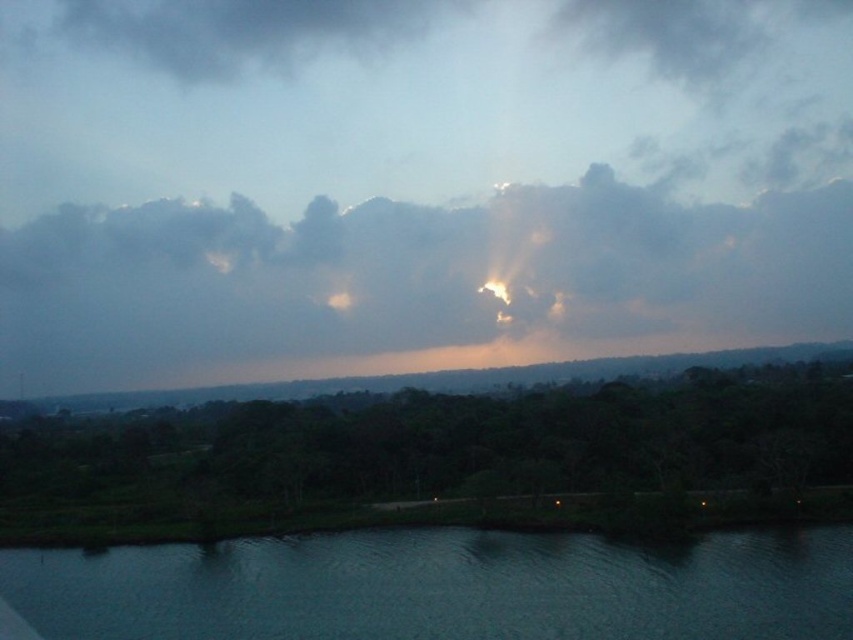
You are an artist trying to paint this landscape. You want to ensure the smokey gray cloud at upper center and the dark blue water at lower center are proportionally accurate. Which object should you paint first if you want to start with the larger one?

The smokey gray cloud at upper center should be painted first since it has a larger size compared to the dark blue water at lower center according to the description.

You are an artist planning to paint the scene. You need to decide which area to focus on first based on their sizes. Which object should you paint first, the smokey gray cloud at upper center or the dark blue water at lower center?

The smokey gray cloud at upper center might be wider than dark blue water at lower center, so you should paint the smokey gray cloud at upper center first to ensure proper scaling with the dark blue water at lower center.